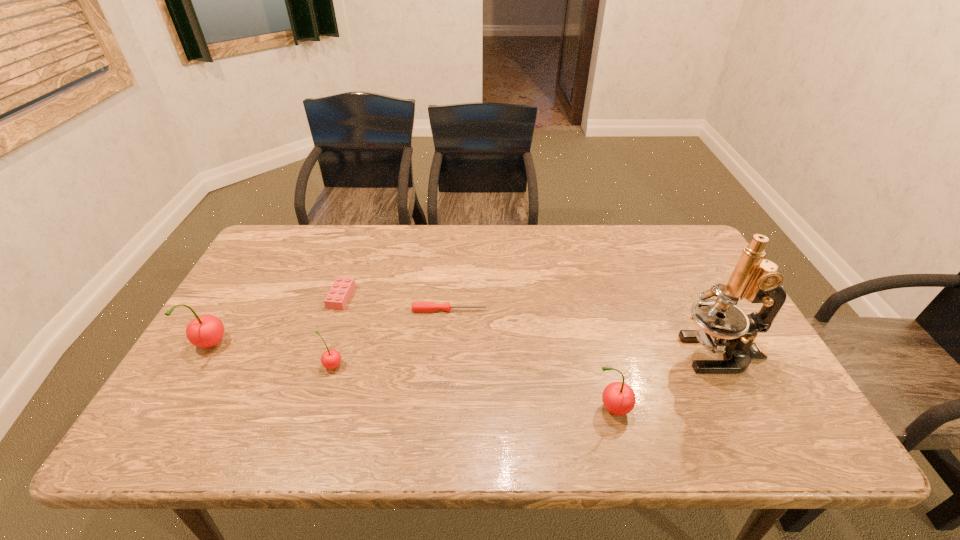
You are a GUI agent. You are given a task and a screenshot of the screen. Output one action in this format:
    pyautogui.click(x=<x>, y=<y>)
    Task: Click on the free location located 0.060m on the back of the leftmost cherry
    
    Given the screenshot: What is the action you would take?
    pos(229,315)

Find the location of a particular element. free space located 0.190m on the back of the second cherry from left to right is located at coordinates (351, 305).

This screenshot has width=960, height=540. Identify the location of vacant space located on the left of the nearest object. (424, 409).

Image resolution: width=960 pixels, height=540 pixels. Find the location of `vacant area situated on the back of the Lego`. vacant area situated on the back of the Lego is located at coordinates (350, 272).

Locate an element on the screen. The image size is (960, 540). free space located 0.310m at the tip of the screwdriver is located at coordinates (597, 310).

Image resolution: width=960 pixels, height=540 pixels. What are the coordinates of `blank space located 0.350m at the eyepiece of the microscope` in the screenshot? It's located at [539, 353].

This screenshot has width=960, height=540. Find the location of `free space located 0.300m at the eyepiece of the microscope`. free space located 0.300m at the eyepiece of the microscope is located at coordinates (558, 353).

Where is `free space located 0.390m at the eyepiece of the microscope`? This screenshot has width=960, height=540. free space located 0.390m at the eyepiece of the microscope is located at coordinates (522, 353).

Find the location of a particular element. object present at the near edge is located at coordinates (618, 398).

Identify the location of object situated at the left edge. The width and height of the screenshot is (960, 540). coord(205,331).